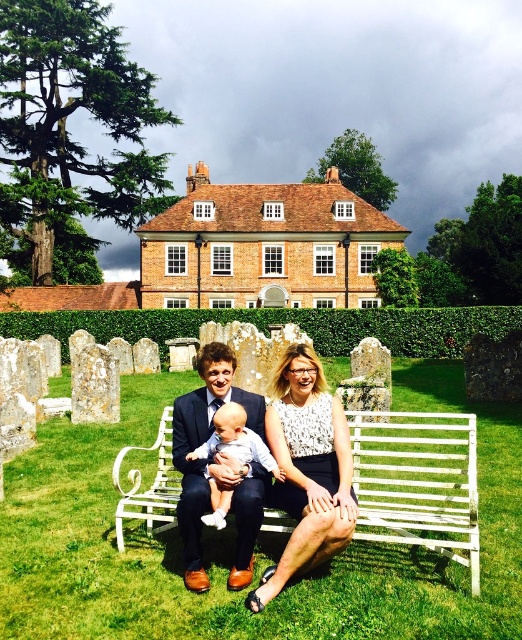
Question: Is white metal bench at center smaller than light blue fabric baby at center?

Choices:
 (A) yes
 (B) no

Answer: (B)

Question: Is white metal bench at center to the right of white lace blouse at center from the viewer's perspective?

Choices:
 (A) yes
 (B) no

Answer: (A)

Question: Estimate the real-world distances between objects in this image. Which object is farther from the white metal bench at center?

Choices:
 (A) light blue fabric baby at center
 (B) white lace blouse at center

Answer: (A)

Question: Which object appears farthest from the camera in this image?

Choices:
 (A) matte black suit at center
 (B) white lace blouse at center
 (C) light blue fabric baby at center

Answer: (C)

Question: Which of these objects is positioned closest to the white lace blouse at center?

Choices:
 (A) white metal bench at center
 (B) matte black suit at center
 (C) light blue fabric baby at center

Answer: (B)

Question: Is white lace blouse at center to the right of matte black suit at center from the viewer's perspective?

Choices:
 (A) no
 (B) yes

Answer: (B)